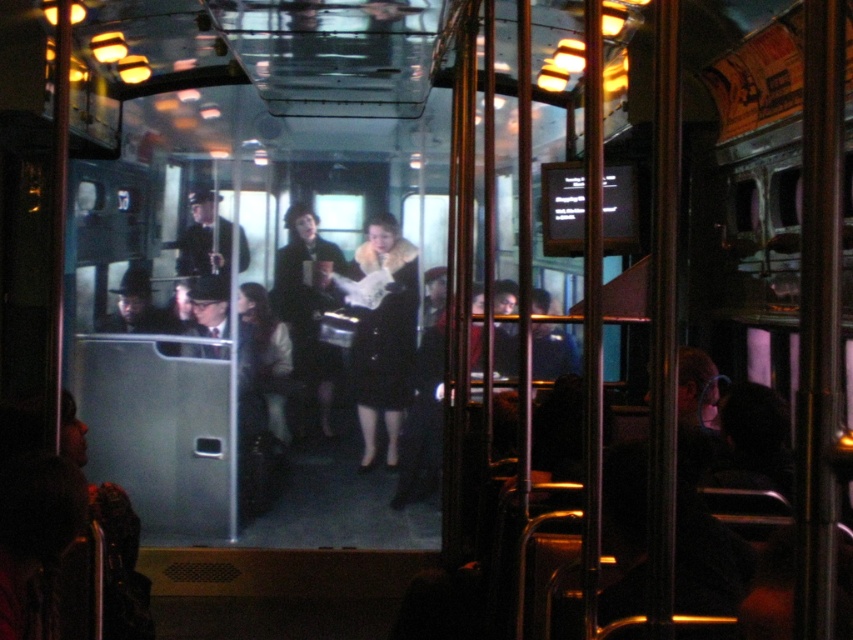
In the scene shown: You are a tailor observing the vintage train car interior. You notice two coats hanging on adjacent hooks near the polished metal poles. Which coat is positioned higher on its hook? The coats in question are the black velvet coat at center and the matte black coat at center.

The black velvet coat at center is positioned higher on its hook compared to the matte black coat at center, as it is described as being above the matte black coat at center.

You are a passenger on this vintage train car and want to place your small backpack on the floor. The backpack requires a clear space of at least 0.5 meters in width. Given the coordinates of the black velvet coat at center, can you determine if there is enough space next to it for your backpack?

The black velvet coat at center is located at coordinates point (384, 337). Since the backpack requires 0.5 meters in width and the coat is a single object, there should be sufficient space next to it for the backpack unless other objects are blocking the area. However, the provided information does not mention any other objects obstructing the space, so it is likely there is enough room.

You are a photographer trying to capture both the black velvet coat at center and the uniformed dark coat at center in the same frame. Given their height difference, which coat will appear larger in the photo?

The black velvet coat at center will appear larger in the photo because it is much taller than the uniformed dark coat at center.